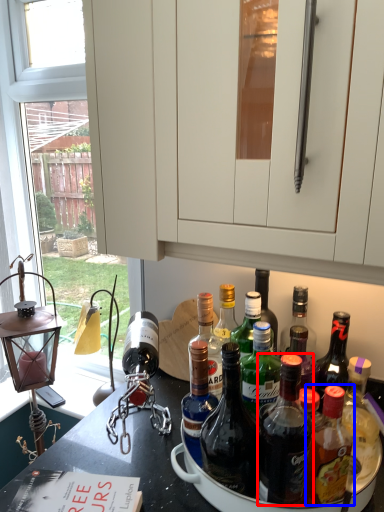
Question: Which object appears farthest to the camera in this image, bottle (highlighted by a red box) or bottle (highlighted by a blue box)?

Choices:
 (A) bottle
 (B) bottle

Answer: (B)